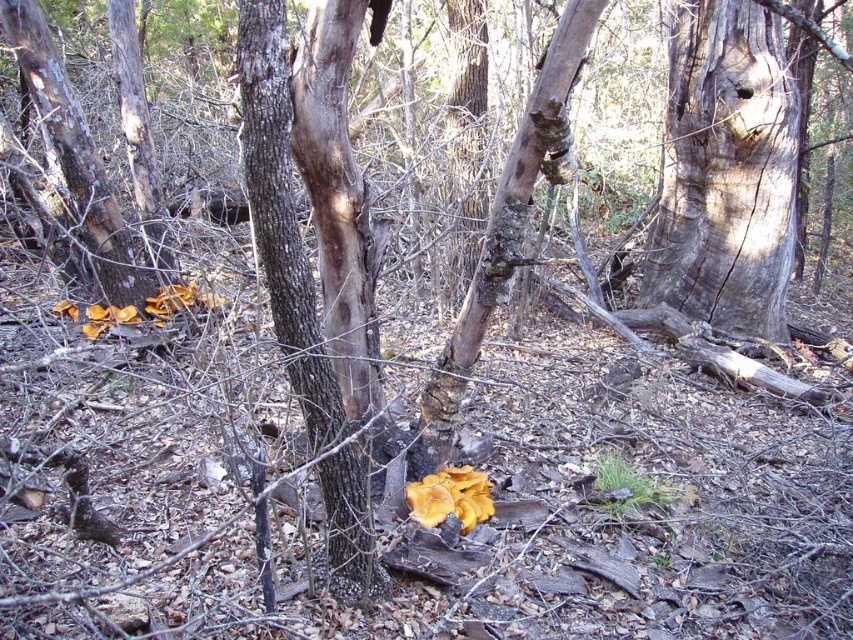
Describe the element at coordinates (726, 170) in the screenshot. I see `smooth gray bark at center` at that location.

Does point (729, 106) come behind point (271, 179)?

Yes, point (729, 106) is behind point (271, 179).

Who is more forward, [743,145] or [355,508]?

Positioned in front is point [355,508].

This screenshot has height=640, width=853. Identify the location of smooth gray bark at center. (726, 170).

Is brown rough bark at center above smooth brown tree trunk at left?

No, brown rough bark at center is not above smooth brown tree trunk at left.

Measure the distance from brown rough bark at center to smooth brown tree trunk at left.

11.45 feet

Is point (381, 573) positioned before point (48, 109)?

Yes, point (381, 573) is closer to viewer.

Find the location of a particular element. The image size is (853, 640). brown rough bark at center is located at coordinates [282, 216].

Who is lower down, smooth gray bark at center or smooth brown tree trunk at left?

smooth brown tree trunk at left is lower down.

Who is shorter, smooth gray bark at center or smooth brown tree trunk at left?

smooth brown tree trunk at left is shorter.

Image resolution: width=853 pixels, height=640 pixels. Find the location of `smooth gray bark at center`. smooth gray bark at center is located at coordinates (726, 170).

Image resolution: width=853 pixels, height=640 pixels. In order to click on smooth gray bark at center in this screenshot , I will do `click(726, 170)`.